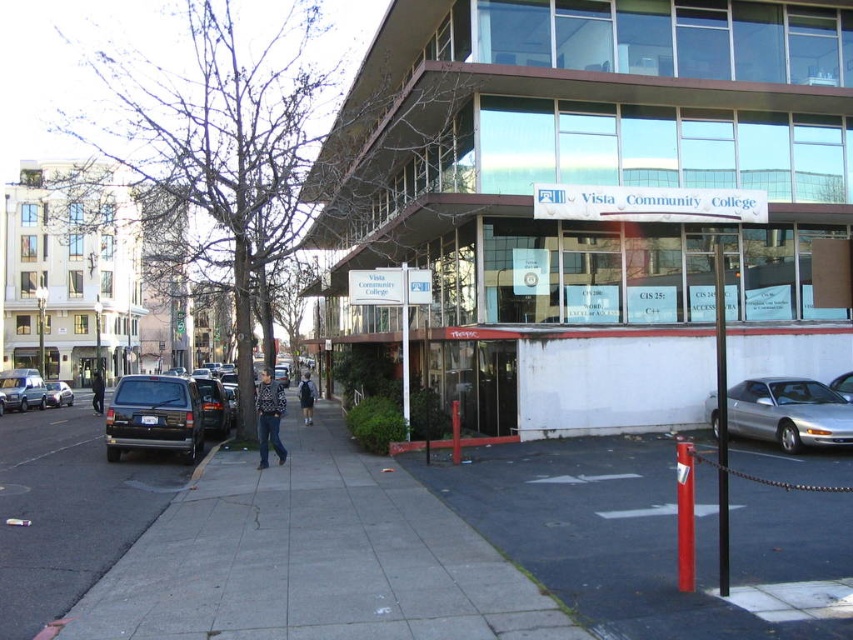
Who is more distant from viewer, (439,502) or (299,397)?

Positioned behind is point (299,397).

How distant is gray concrete sidewalk at center from dark gray backpack at center?

gray concrete sidewalk at center is 16.27 meters from dark gray backpack at center.

Between point (354, 577) and point (305, 408), which one is positioned behind?

Positioned behind is point (305, 408).

You are a GUI agent. You are given a task and a screenshot of the screen. Output one action in this format:
    pyautogui.click(x=<x>, y=<y>)
    Task: Click on the gray concrete sidewalk at center
    
    Given the screenshot: What is the action you would take?
    pyautogui.click(x=312, y=557)

Can you confirm if dark gray backpack at center is thinner than matte black van at lower left?

Correct, dark gray backpack at center's width is less than matte black van at lower left's.

Is dark gray backpack at center to the left of matte black van at lower left from the viewer's perspective?

No, dark gray backpack at center is not to the left of matte black van at lower left.

At what (x,y) coordinates should I click in order to perform the action: click on dark gray backpack at center. Please return your answer as a coordinate pair (x, y). This screenshot has height=640, width=853. Looking at the image, I should click on (306, 397).

At what (x,y) coordinates should I click in order to perform the action: click on dark gray backpack at center. Please return your answer as a coordinate pair (x, y). The width and height of the screenshot is (853, 640). Looking at the image, I should click on point(306,397).

Does silver metallic car at lower right appear on the right side of matte black van at lower left?

Yes, silver metallic car at lower right is to the right of matte black van at lower left.

Does silver metallic car at lower right have a smaller size compared to matte black van at lower left?

A: Indeed, silver metallic car at lower right has a smaller size compared to matte black van at lower left.

Describe the element at coordinates (788, 412) in the screenshot. I see `silver metallic car at lower right` at that location.

The height and width of the screenshot is (640, 853). Identify the location of silver metallic car at lower right. (788, 412).